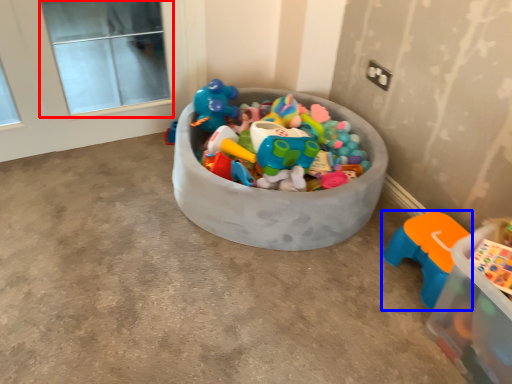
Question: Which point is further to the camera, window screen (highlighted by a red box) or toy (highlighted by a blue box)?

Choices:
 (A) window screen
 (B) toy

Answer: (A)